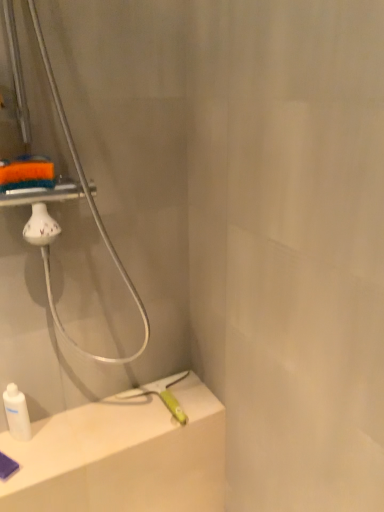
This screenshot has width=384, height=512. Identify the location of vacant area in front of white glossy bottle at lower left. (21, 466).